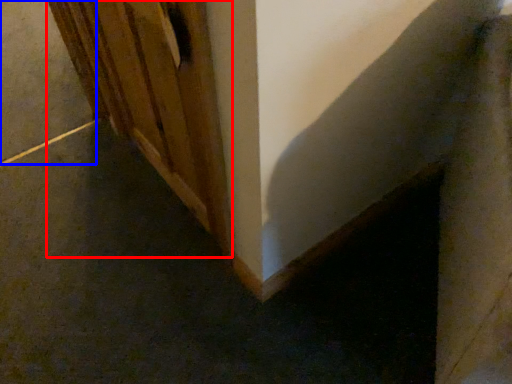
Question: Among these objects, which one is nearest to the camera, door (highlighted by a red box) or concrete (highlighted by a blue box)?

Choices:
 (A) door
 (B) concrete

Answer: (A)